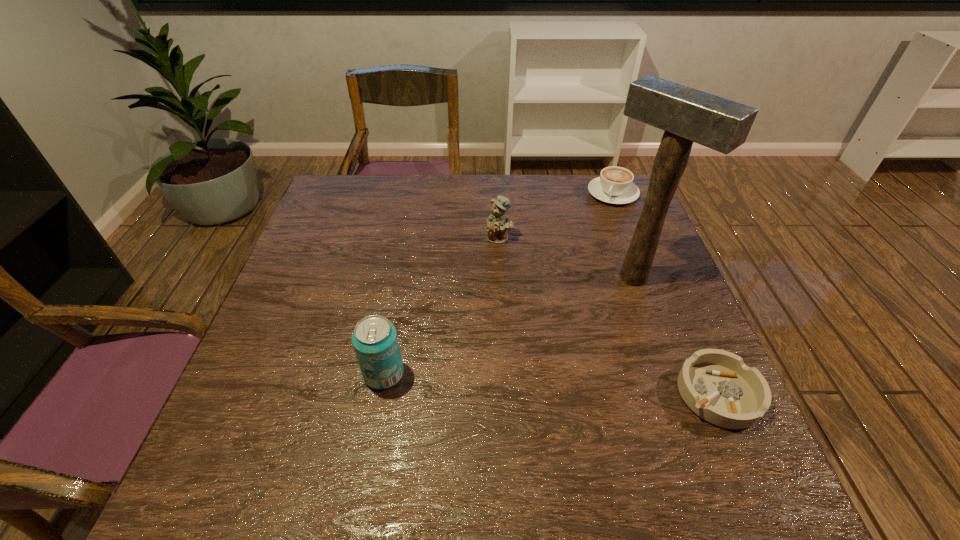
Identify the location of blank region between the tallest object and the beer can. This screenshot has height=540, width=960. (509, 325).

The image size is (960, 540). In order to click on object that can be found as the closest to the shortest object in this screenshot , I will do `click(687, 115)`.

Select which object appears as the closest to the second farthest object. Please provide its 2D coordinates. Your answer should be formatted as a tuple, i.e. [(x, y)], where the tuple contains the x and y coordinates of a point satisfying the conditions above.

[(687, 115)]

The height and width of the screenshot is (540, 960). In order to click on vacant space that satisfies the following two spatial constraints: 1. on the front side of the teddy bear; 2. on the left side of the tallest object in this screenshot , I will do `click(501, 276)`.

Where is `blank space that satisfies the following two spatial constraints: 1. on the front side of the teddy bear; 2. on the right side of the tallest object`? This screenshot has width=960, height=540. blank space that satisfies the following two spatial constraints: 1. on the front side of the teddy bear; 2. on the right side of the tallest object is located at coordinates (501, 276).

The height and width of the screenshot is (540, 960). I want to click on vacant space that satisfies the following two spatial constraints: 1. on the back side of the leftmost object; 2. on the right side of the cappuccino, so click(x=417, y=193).